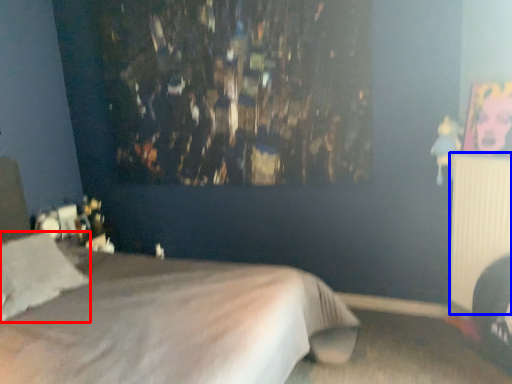
Question: Which object is closer to the camera taking this photo, pillow (highlighted by a red box) or radiator (highlighted by a blue box)?

Choices:
 (A) pillow
 (B) radiator

Answer: (A)